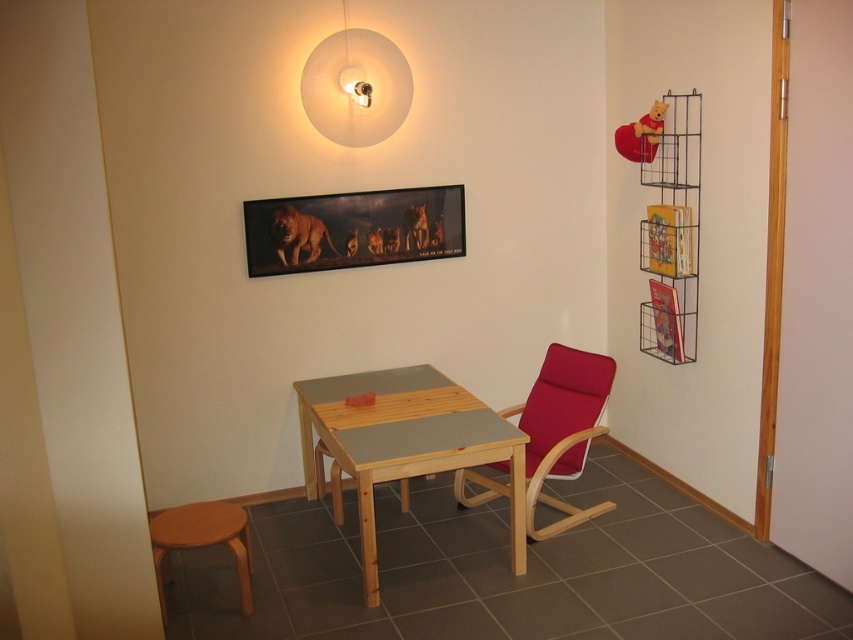
Question: Based on their relative distances, which object is farther from the metallic glossy picture frame at upper center?

Choices:
 (A) white matte lampshade at upper center
 (B) matte red chair at center
 (C) light brown wooden table at center
 (D) wooden stool at lower left

Answer: (D)

Question: Does matte red chair at center have a lesser width compared to wooden stool at lower left?

Choices:
 (A) yes
 (B) no

Answer: (B)

Question: Which point is farther to the camera?

Choices:
 (A) (376, 596)
 (B) (392, 44)

Answer: (B)

Question: Can you confirm if light brown wooden table at center is smaller than metallic glossy picture frame at upper center?

Choices:
 (A) yes
 (B) no

Answer: (B)

Question: Which point is closer to the camera taking this photo?

Choices:
 (A) (529, 488)
 (B) (299, 384)

Answer: (A)

Question: From the image, what is the correct spatial relationship of light brown wooden table at center in relation to metallic glossy picture frame at upper center?

Choices:
 (A) below
 (B) above

Answer: (A)